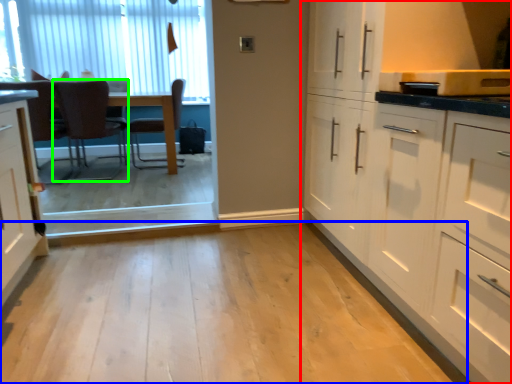
Question: Which is farther away from cabinetry (highlighted by a red box)? plain (highlighted by a blue box) or chair (highlighted by a green box)?

Choices:
 (A) plain
 (B) chair

Answer: (B)